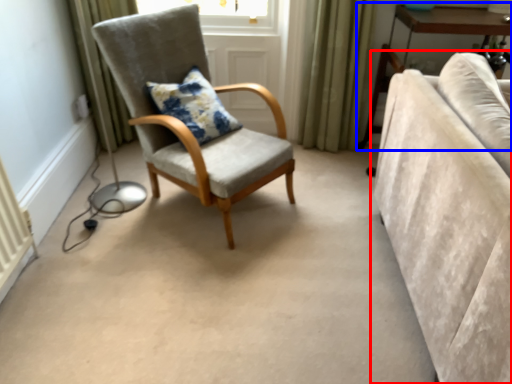
Question: Which object is closer to the camera taking this photo, studio couch (highlighted by a red box) or table (highlighted by a blue box)?

Choices:
 (A) studio couch
 (B) table

Answer: (A)